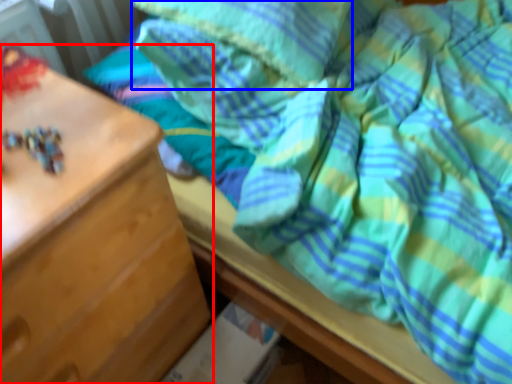
Question: Which object is closer to the camera taking this photo, chest of drawers (highlighted by a red box) or pillow (highlighted by a blue box)?

Choices:
 (A) chest of drawers
 (B) pillow

Answer: (A)